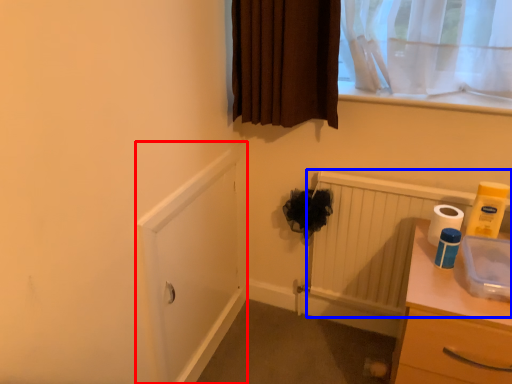
Question: Which point is closer to the camera, screen door (highlighted by a red box) or radiator (highlighted by a blue box)?

Choices:
 (A) screen door
 (B) radiator

Answer: (A)